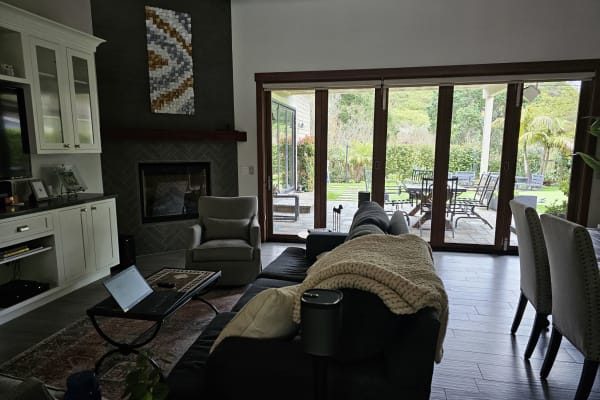
This screenshot has height=400, width=600. Find the location of `fireplace`. fireplace is located at coordinates (174, 188).